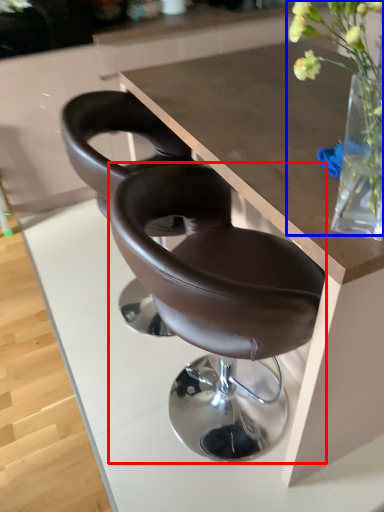
Question: Among these objects, which one is farthest to the camera, chair (highlighted by a red box) or floral arrangement (highlighted by a blue box)?

Choices:
 (A) chair
 (B) floral arrangement

Answer: (A)